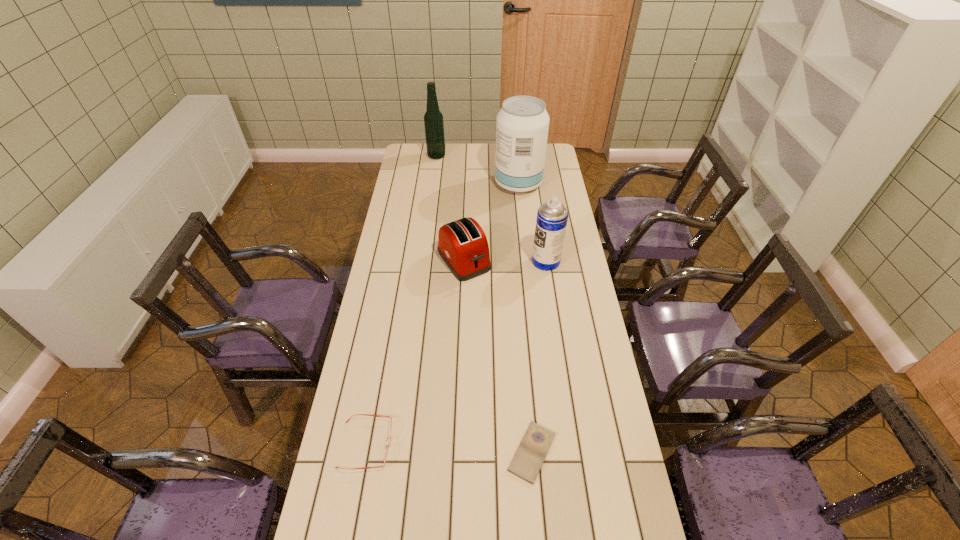
The width and height of the screenshot is (960, 540). I want to click on alcohol present at the right edge, so click(x=522, y=125).

You are a GUI agent. You are given a task and a screenshot of the screen. Output one action in this format:
    pyautogui.click(x=<x>, y=<y>)
    Task: Click on the aerosol can that is at the right edge
    The height and width of the screenshot is (540, 960).
    Given the screenshot: What is the action you would take?
    pyautogui.click(x=552, y=216)

The height and width of the screenshot is (540, 960). In order to click on object that is at the far left corner in this screenshot , I will do `click(433, 119)`.

In order to click on free region at the far edge of the desktop in this screenshot , I will do `click(468, 157)`.

In the image, there is a desktop. Where is `free region at the left edge`? free region at the left edge is located at coordinates (426, 202).

At what (x,y) coordinates should I click in order to perform the action: click on vacant space at the right edge. Please return your answer as a coordinate pair (x, y). This screenshot has height=540, width=960. Looking at the image, I should click on (543, 195).

The width and height of the screenshot is (960, 540). In the image, there is a desktop. Find the location of `vacant area at the far left corner`. vacant area at the far left corner is located at coordinates click(x=409, y=159).

This screenshot has width=960, height=540. Find the location of `empty space between the spectacles and the aerosol can`. empty space between the spectacles and the aerosol can is located at coordinates (456, 353).

Find the location of `vacant area between the second shortest object and the diary`. vacant area between the second shortest object and the diary is located at coordinates (449, 448).

Locate an element on the screen. The height and width of the screenshot is (540, 960). vacant space that's between the shortest object and the left alcohol is located at coordinates (484, 304).